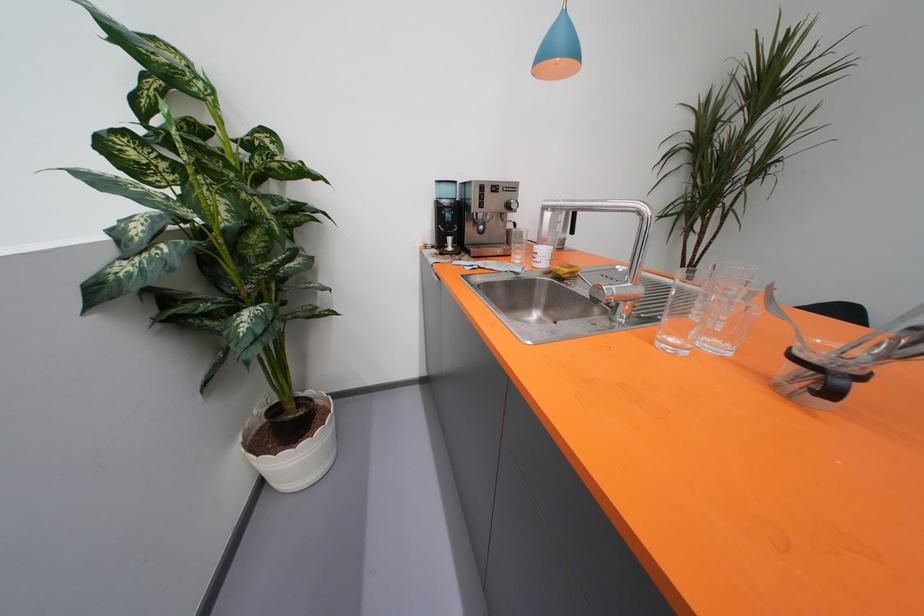
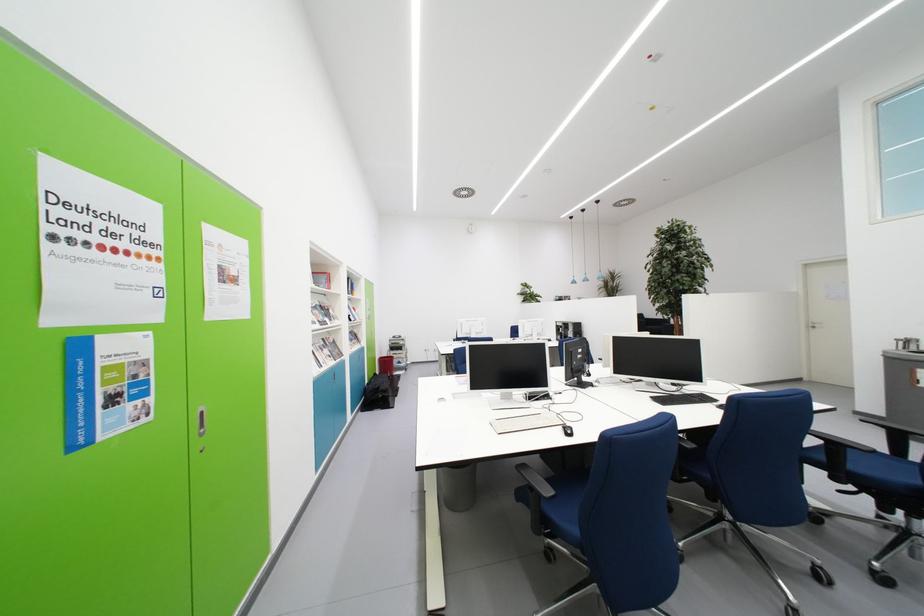
Question: I am providing you with two images of the same scene from different viewpoints. Please identify which objects are invisible in image2.

Choices:
 (A) black board eraser
 (B) silver cabinet handle
 (C) book on shelf
 (D) coffee machine dial

Answer: (D)